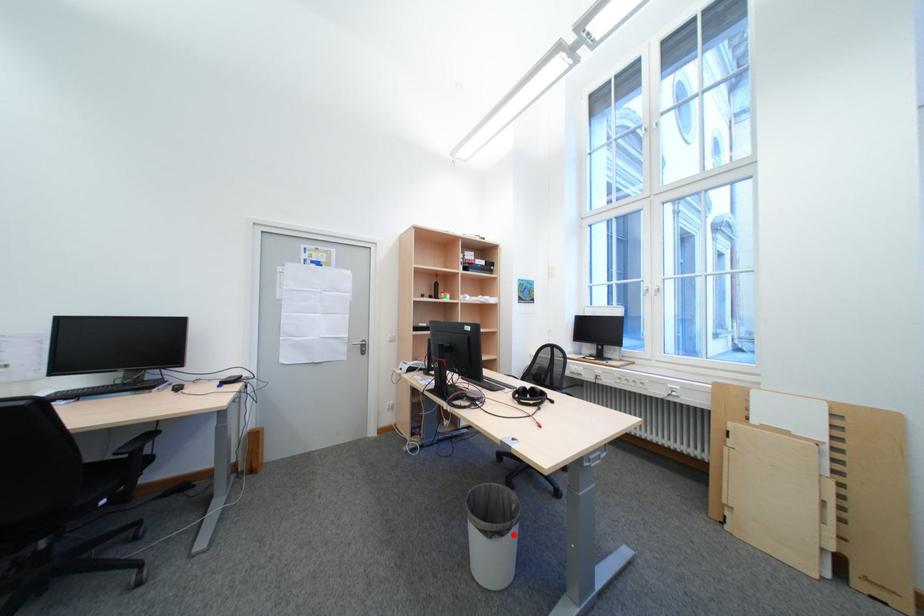
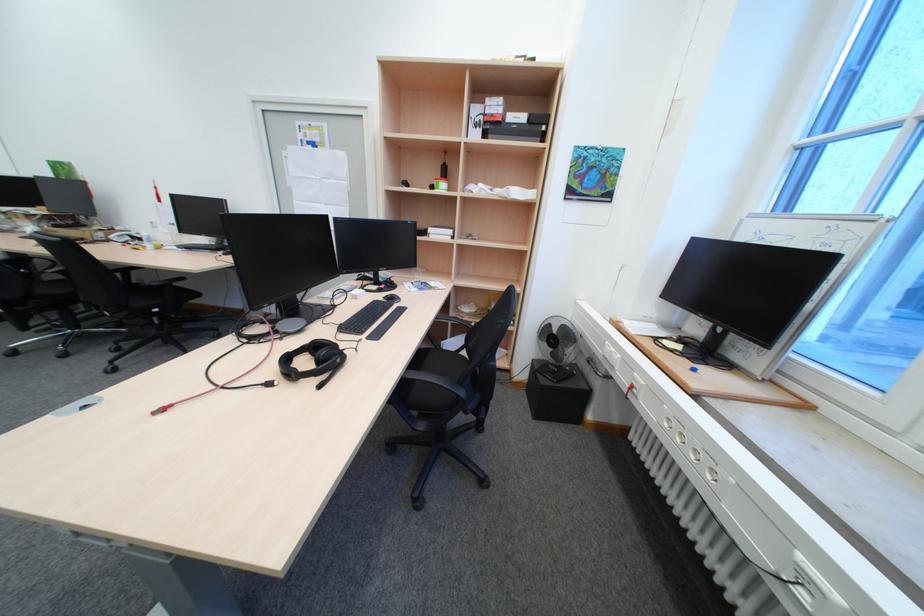
Question: I am providing you with two images of the same scene from different viewpoints. A red point is marked on the first image. Can you still see the location of the red point in image 2?

Choices:
 (A) Yes
 (B) No

Answer: (B)